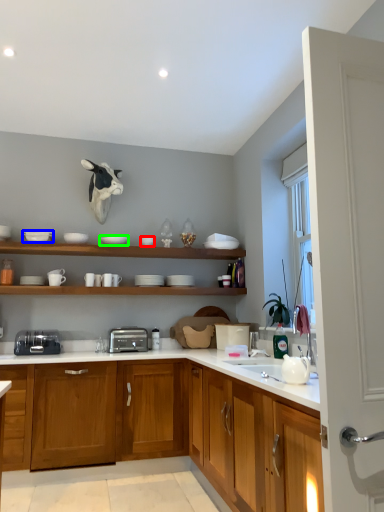
Question: Which object is positioned closest to tableware (highlighted by a red box)? Select from tableware (highlighted by a blue box) and tableware (highlighted by a green box).

Choices:
 (A) tableware
 (B) tableware

Answer: (B)